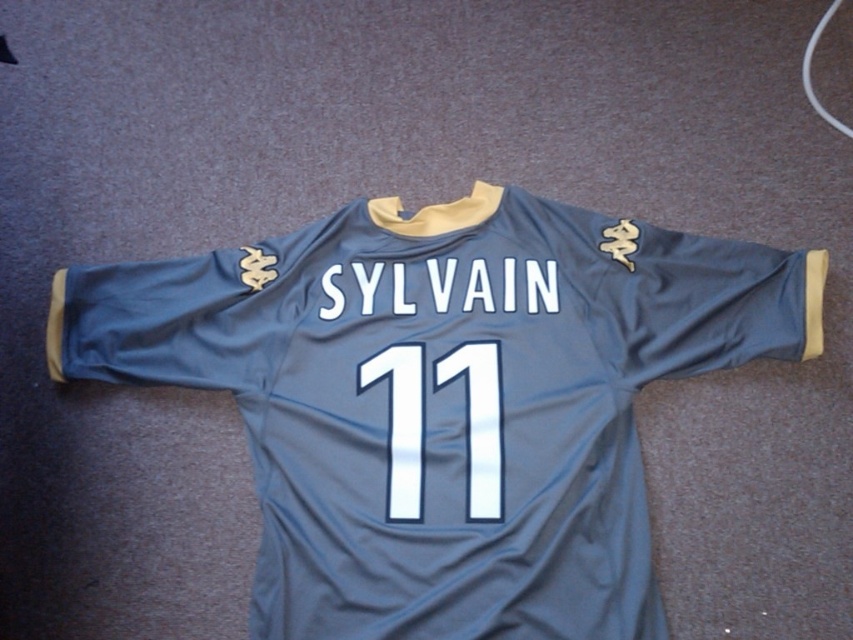
You are an athlete trying to find your jersey number on your matte gray jersey at center. You notice a white glossy number at center. Which object is bigger in size?

The matte gray jersey at center is larger in size than the white glossy number at center.